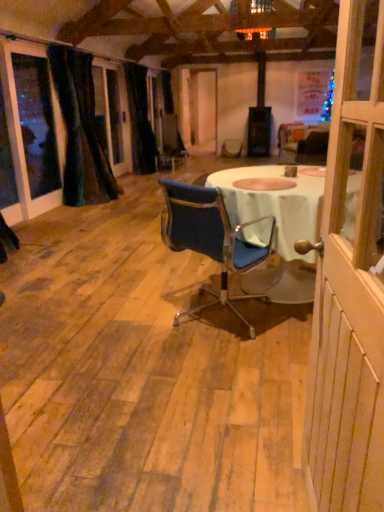
Identify the location of blank space to the left of blue fabric chair at center. (123, 323).